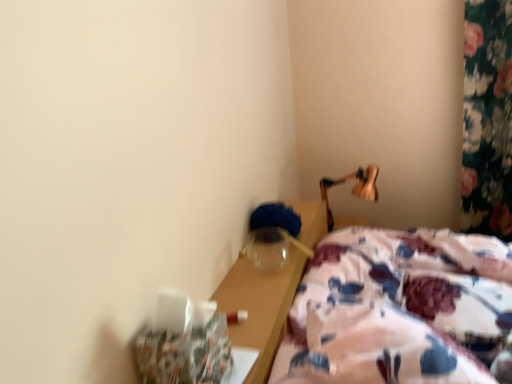
What do you see at coordinates (353, 188) in the screenshot? I see `wooden lamp at upper right` at bounding box center [353, 188].

Find the location of a particular element. wooden lamp at upper right is located at coordinates (353, 188).

At what (x,y) coordinates should I click in order to perform the action: click on floral fabric bed at lower right. Please return your answer as a coordinate pair (x, y). Looking at the image, I should click on (398, 309).

This screenshot has height=384, width=512. What do you see at coordinates (398, 309) in the screenshot? I see `floral fabric bed at lower right` at bounding box center [398, 309].

Identify the location of wooden lamp at upper right. This screenshot has width=512, height=384. (353, 188).

Which object is positioned more to the right, wooden lamp at upper right or floral fabric bed at lower right?

wooden lamp at upper right.

Considering their positions, is wooden lamp at upper right located in front of or behind floral fabric bed at lower right?

wooden lamp at upper right is positioned farther from the viewer than floral fabric bed at lower right.

Which is closer, (330, 220) or (342, 380)?

The point (342, 380) is more forward.

In the scene shown: From the image's perspective, is wooden lamp at upper right above floral fabric bed at lower right?

Yes, from the image's perspective, wooden lamp at upper right is over floral fabric bed at lower right.

From a real-world perspective, is wooden lamp at upper right on top of floral fabric bed at lower right?

No, from a real-world perspective, wooden lamp at upper right is not on top of floral fabric bed at lower right.

Does wooden lamp at upper right have a greater width compared to floral fabric bed at lower right?

In fact, wooden lamp at upper right might be narrower than floral fabric bed at lower right.

In terms of height, does wooden lamp at upper right look taller or shorter compared to floral fabric bed at lower right?

Considering their sizes, wooden lamp at upper right has less height than floral fabric bed at lower right.

From the picture: Between wooden lamp at upper right and floral fabric bed at lower right, which one has smaller size?

Smaller between the two is wooden lamp at upper right.

Is wooden lamp at upper right outside of floral fabric bed at lower right?

Absolutely, wooden lamp at upper right is external to floral fabric bed at lower right.

Is wooden lamp at upper right touching floral fabric bed at lower right?

No, wooden lamp at upper right is not next to floral fabric bed at lower right.

Could you tell me if wooden lamp at upper right is turned towards floral fabric bed at lower right?

No, wooden lamp at upper right does not turn towards floral fabric bed at lower right.

The image size is (512, 384). What are the coordinates of `bedside lamp on the right side of floral fabric bed at lower right` in the screenshot? It's located at (353, 188).

Considering the relative positions of floral fabric bed at lower right and wooden lamp at upper right in the image provided, is floral fabric bed at lower right to the left or to the right of wooden lamp at upper right?

Clearly, floral fabric bed at lower right is on the left of wooden lamp at upper right in the image.

Is the depth of floral fabric bed at lower right greater than that of wooden lamp at upper right?

That is False.

Between point (282, 349) and point (321, 189), which one is positioned behind?

The point (321, 189) is behind.

From the image's perspective, who appears lower, floral fabric bed at lower right or wooden lamp at upper right?

floral fabric bed at lower right, from the image's perspective.

From a real-world perspective, between floral fabric bed at lower right and wooden lamp at upper right, who is vertically lower?

wooden lamp at upper right, from a real-world perspective.

Considering the sizes of objects floral fabric bed at lower right and wooden lamp at upper right in the image provided, who is wider, floral fabric bed at lower right or wooden lamp at upper right?

Wider between the two is floral fabric bed at lower right.

Considering the relative sizes of floral fabric bed at lower right and wooden lamp at upper right in the image provided, is floral fabric bed at lower right taller than wooden lamp at upper right?

Yes.

Can you confirm if floral fabric bed at lower right is smaller than wooden lamp at upper right?

Incorrect, floral fabric bed at lower right is not smaller in size than wooden lamp at upper right.

Would you say floral fabric bed at lower right is inside or outside wooden lamp at upper right?

The correct answer is: outside.

Is floral fabric bed at lower right next to wooden lamp at upper right?

floral fabric bed at lower right is not next to wooden lamp at upper right, and they're not touching.

Is floral fabric bed at lower right facing away from wooden lamp at upper right?

No, wooden lamp at upper right is not at the back of floral fabric bed at lower right.

Identify the location of bed lying in front of the wooden lamp at upper right. The image size is (512, 384). (398, 309).

The image size is (512, 384). In order to click on bedside lamp on the right of floral fabric bed at lower right in this screenshot , I will do `click(353, 188)`.

I want to click on bed to the left of wooden lamp at upper right, so click(x=398, y=309).